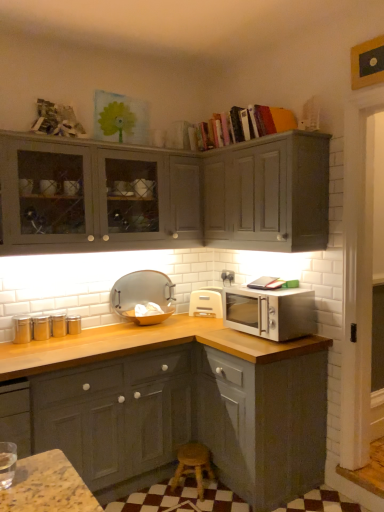
At what (x,y) coordinates should I click in order to perform the action: click on vacant area situated to the left side of wooden at lower center. Please return your answer as a coordinate pair (x, y). This screenshot has height=512, width=384. Looking at the image, I should click on (162, 495).